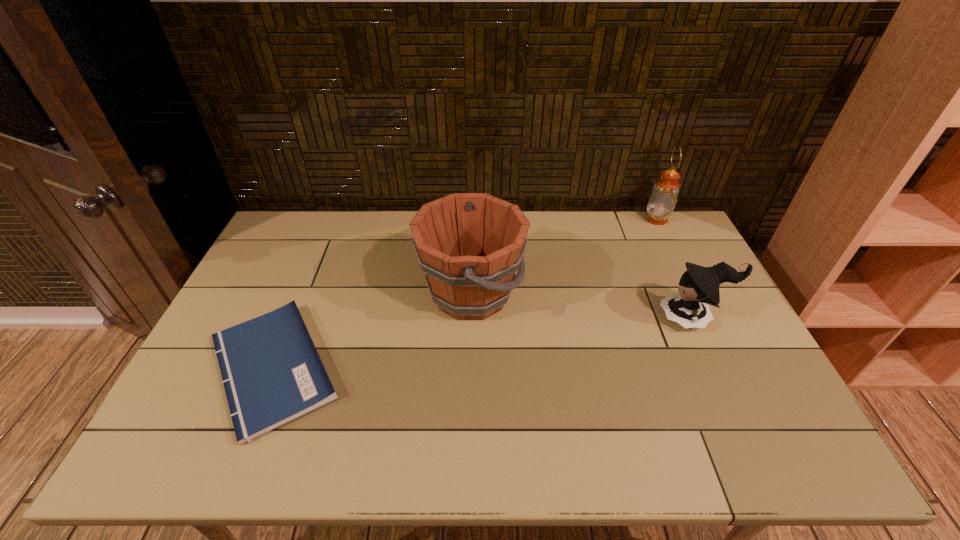
The image size is (960, 540). I want to click on free spot at the left edge of the desktop, so click(x=182, y=416).

Image resolution: width=960 pixels, height=540 pixels. Identify the location of vacant space at the far left corner of the desktop. (310, 237).

The image size is (960, 540). Identify the location of vacant space at the far right corner of the desktop. (659, 239).

Where is `vacant point located between the third object from right to left and the doll`? Image resolution: width=960 pixels, height=540 pixels. vacant point located between the third object from right to left and the doll is located at coordinates (582, 306).

The image size is (960, 540). I want to click on unoccupied position between the third object from right to left and the paperback book, so click(x=372, y=330).

The height and width of the screenshot is (540, 960). Find the location of `vacant area that lies between the doll and the farthest object`. vacant area that lies between the doll and the farthest object is located at coordinates (675, 268).

Find the location of a particular element. Image resolution: width=960 pixels, height=540 pixels. free space between the bucket and the shortest object is located at coordinates (372, 330).

The image size is (960, 540). Find the location of `vacant space that is in between the doll and the shortest object`. vacant space that is in between the doll and the shortest object is located at coordinates pyautogui.click(x=483, y=343).

Locate an element on the screen. The width and height of the screenshot is (960, 540). vacant region between the third tallest object and the oil lamp is located at coordinates (675, 268).

The image size is (960, 540). I want to click on the closest object to the leftmost object, so click(470, 245).